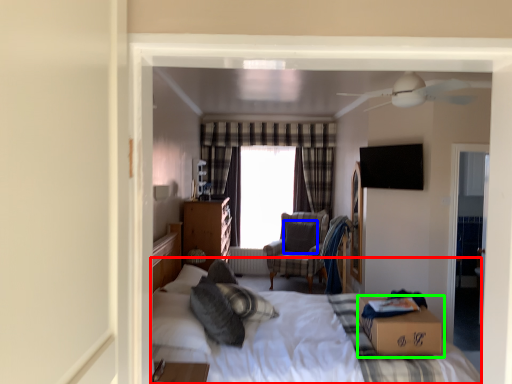
Question: Which is nearer to the bed (highlighted by a red box)? pillow (highlighted by a blue box) or box (highlighted by a green box).

Choices:
 (A) pillow
 (B) box

Answer: (B)